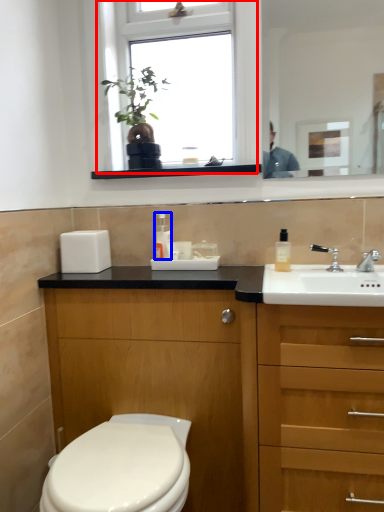
Question: Among these objects, which one is farthest to the camera, window (highlighted by a red box) or toiletry (highlighted by a blue box)?

Choices:
 (A) window
 (B) toiletry

Answer: (B)